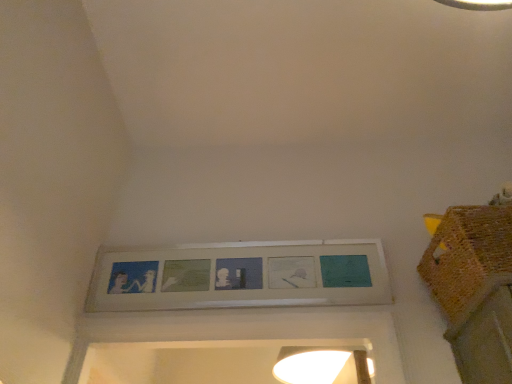
Identify the location of white matte picture frame at upper center. This screenshot has height=384, width=512. tap(239, 276).

What do you see at coordinates (239, 276) in the screenshot? This screenshot has width=512, height=384. I see `white matte picture frame at upper center` at bounding box center [239, 276].

At what (x,y) coordinates should I click in order to perform the action: click on white matte picture frame at upper center. Please return your answer as a coordinate pair (x, y). This screenshot has width=512, height=384. Looking at the image, I should click on (239, 276).